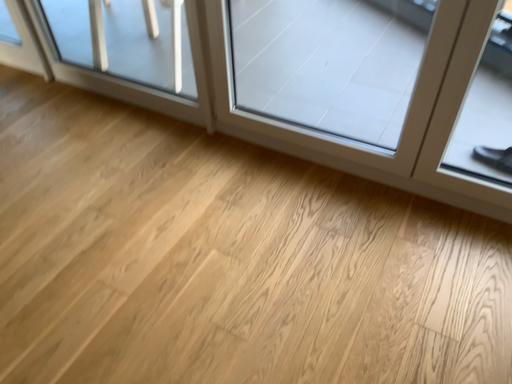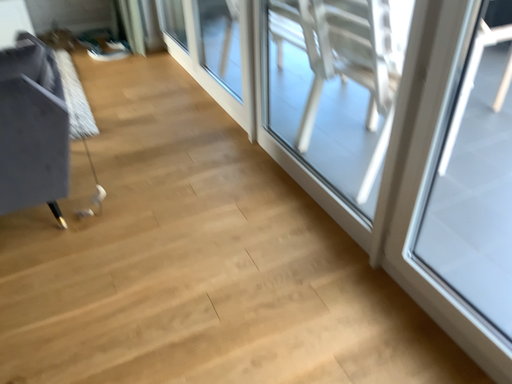
Question: How did the camera likely rotate when shooting the video?

Choices:
 (A) rotated downward
 (B) rotated upward

Answer: (B)